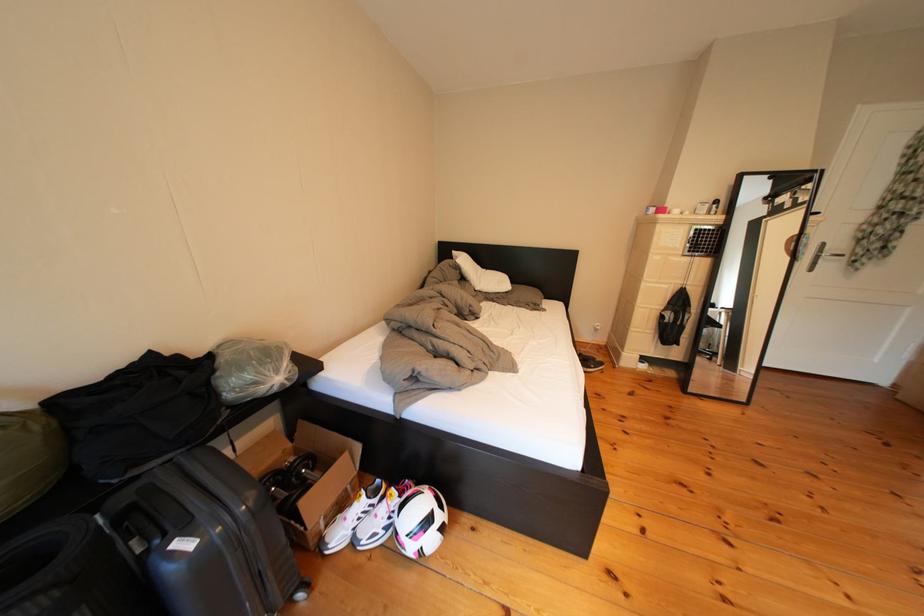
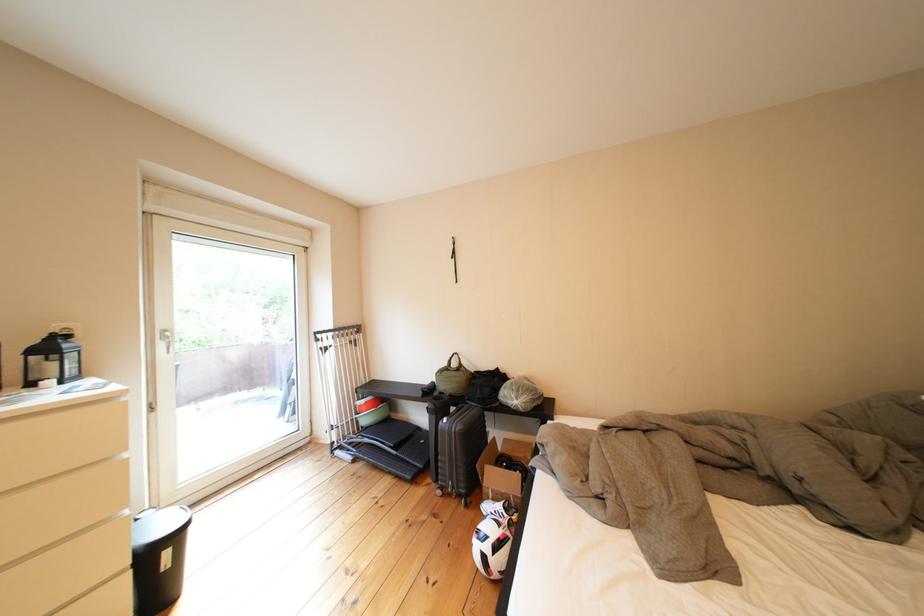
Where in the second image is the point corresponding to point 329,507 from the first image?

(505, 480)